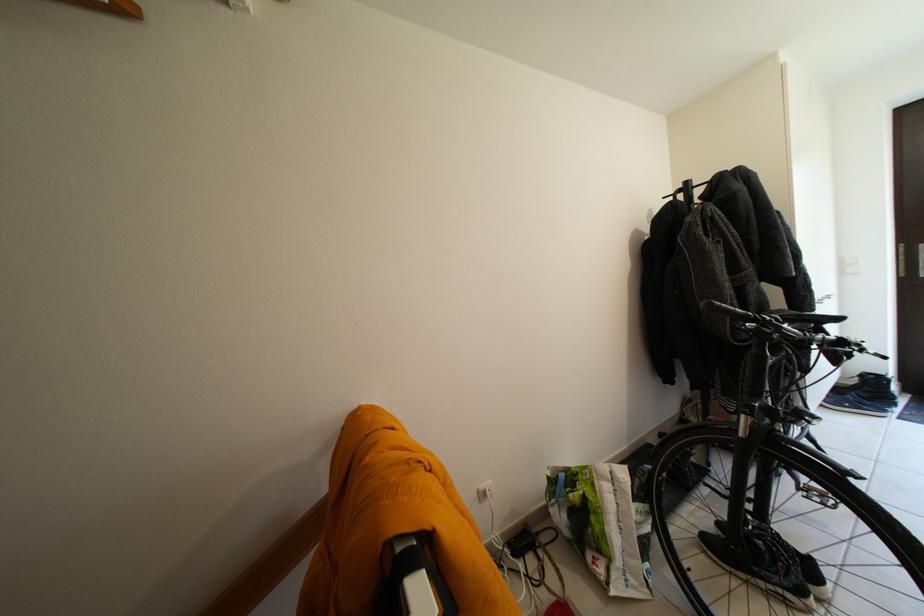
Find the location of `dark blue shoe`. dark blue shoe is located at coordinates (847, 400).